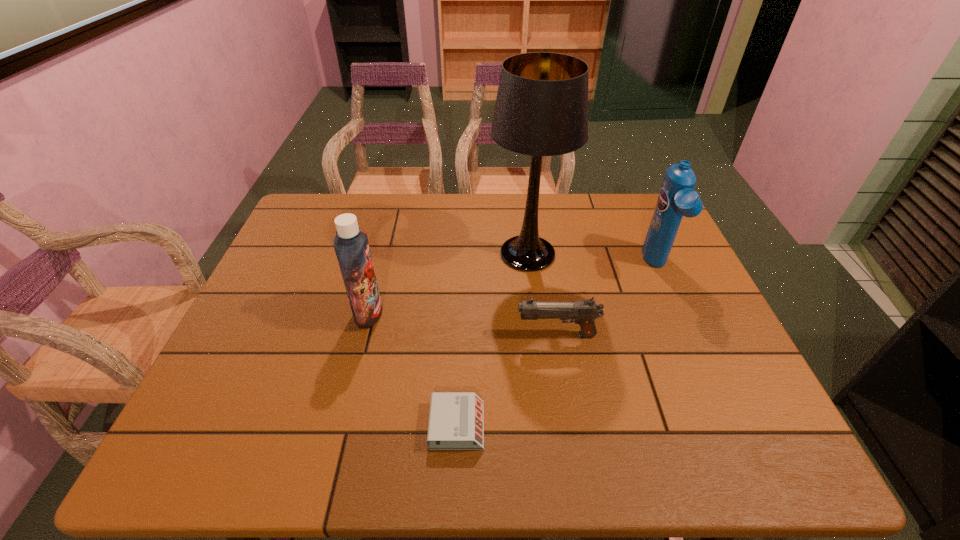
What are the coordinates of `vacant region between the second object from left to right and the table lamp` in the screenshot? It's located at (492, 340).

Image resolution: width=960 pixels, height=540 pixels. Find the location of `free space between the second shortest object and the tallest object`. free space between the second shortest object and the tallest object is located at coordinates (542, 294).

In order to click on vacant point located between the shortest object and the left shampoo in this screenshot , I will do `click(413, 369)`.

This screenshot has height=540, width=960. Identify the location of vacant area between the shortest object and the gun. (507, 380).

You are a GUI agent. You are given a task and a screenshot of the screen. Output one action in this format:
    pyautogui.click(x=<x>, y=<y>)
    Task: Click on the free point between the tallest object and the left shampoo
    The image size is (960, 540).
    Given the screenshot: What is the action you would take?
    pyautogui.click(x=448, y=284)

Select which object appears as the second closest to the right shampoo. Please provide its 2D coordinates. Your answer should be formatted as a tuple, i.e. [(x, y)], where the tuple contains the x and y coordinates of a point satisfying the conditions above.

[(584, 312)]

Locate an element on the screen. This screenshot has width=960, height=540. object that can be found as the second closest to the shortest object is located at coordinates (351, 245).

The image size is (960, 540). I want to click on free region that satisfies the following two spatial constraints: 1. on the back side of the tallest object; 2. on the left side of the nearest object, so click(x=464, y=254).

This screenshot has height=540, width=960. Find the location of `free space in the image that satisfies the following two spatial constraints: 1. on the front label of the leftmost object; 2. on the right side of the shortest object`. free space in the image that satisfies the following two spatial constraints: 1. on the front label of the leftmost object; 2. on the right side of the shortest object is located at coordinates pyautogui.click(x=341, y=425).

Locate an element on the screen. blank space that satisfies the following two spatial constraints: 1. on the front side of the right shampoo; 2. on the front label of the left shampoo is located at coordinates (678, 313).